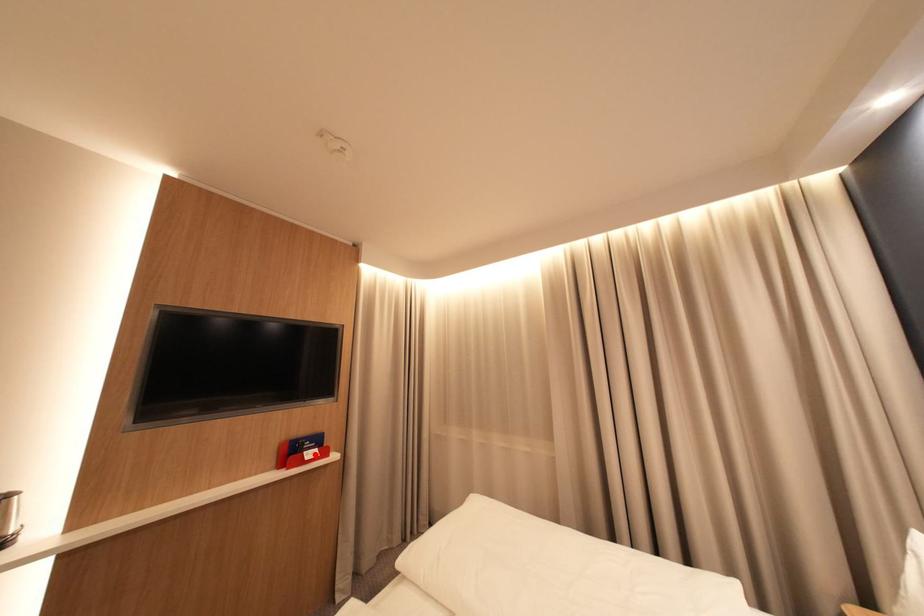
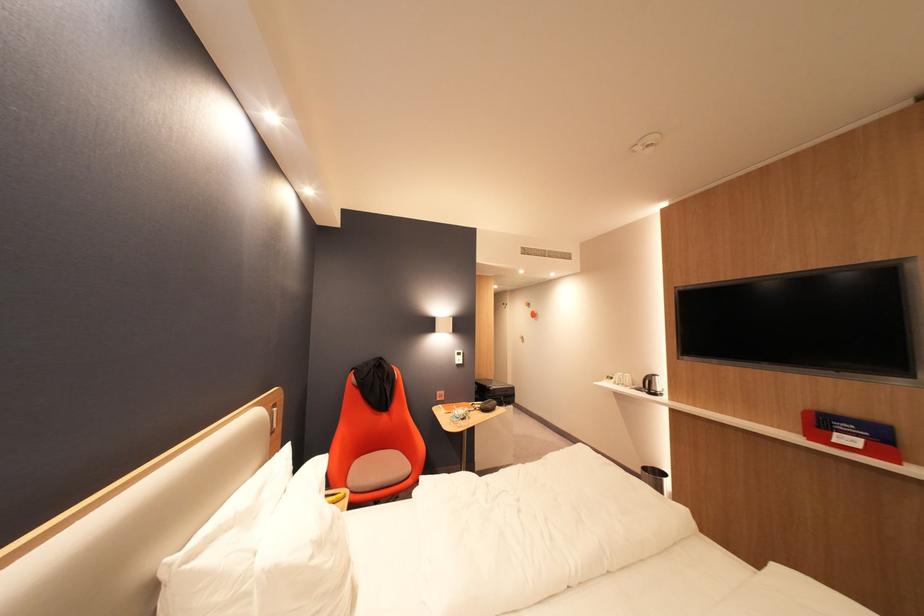
In the second image, find the point that corresponds to the highlighted location in the first image.

(846, 435)